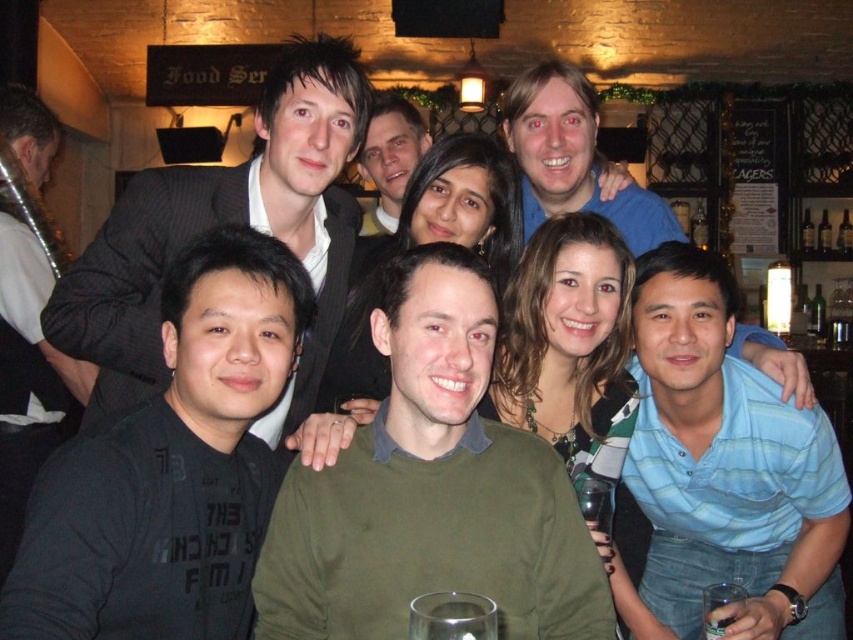
Can you confirm if green matte sweater at center is positioned below smooth black shirt at center?

Yes, green matte sweater at center is below smooth black shirt at center.

Between green matte sweater at center and smooth black shirt at center, which one appears on the right side from the viewer's perspective?

Positioned to the right is green matte sweater at center.

Describe the element at coordinates (431, 490) in the screenshot. This screenshot has height=640, width=853. I see `green matte sweater at center` at that location.

Locate an element on the screen. This screenshot has width=853, height=640. green matte sweater at center is located at coordinates (431, 490).

Does black matte shirt at lower left have a greater height compared to smooth black shirt at center?

Yes.

Is black matte shirt at lower left positioned behind smooth black shirt at center?

No.

The height and width of the screenshot is (640, 853). Identify the location of black matte shirt at lower left. (171, 467).

Who is positioned more to the right, blue striped shirt at lower right or black matte suit at upper left?

Positioned to the right is blue striped shirt at lower right.

Measure the distance between blue striped shirt at lower right and camera.

blue striped shirt at lower right and camera are 5.89 feet apart.

At what (x,y) coordinates should I click in order to perform the action: click on blue striped shirt at lower right. Please return your answer as a coordinate pair (x, y). This screenshot has height=640, width=853. Looking at the image, I should click on (728, 467).